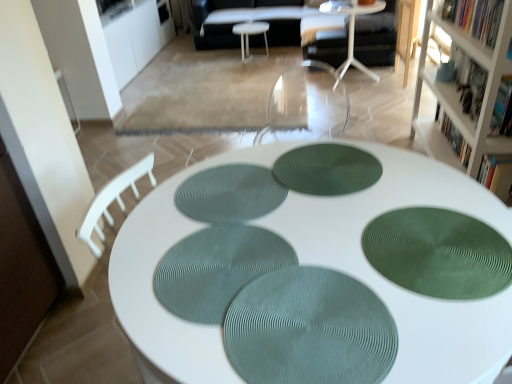
Find the location of `unoccupied space behind green textured placemat at center`. unoccupied space behind green textured placemat at center is located at coordinates (293, 236).